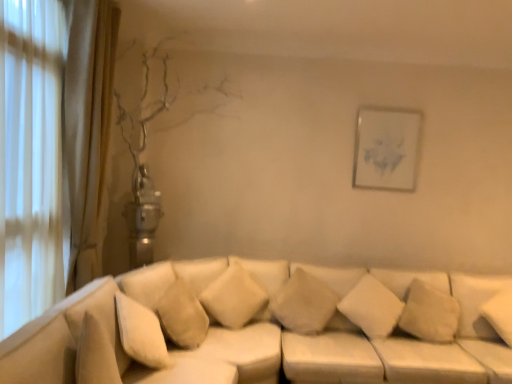
The image size is (512, 384). What are the coordinates of `white soft pillow at right, which is the 1th pillow in right-to-left order` in the screenshot? It's located at (476, 302).

What do you see at coordinates (234, 297) in the screenshot? This screenshot has width=512, height=384. I see `white soft cushion at center, the fourth pillow positioned from the right` at bounding box center [234, 297].

What do you see at coordinates (304, 303) in the screenshot? I see `white soft pillow at center, which is counted as the 3th pillow, starting from the right` at bounding box center [304, 303].

Find the location of `white soft pillow at right, which is the 1th pillow in right-to-left order`. white soft pillow at right, which is the 1th pillow in right-to-left order is located at coordinates (476, 302).

How different are the orientations of white soft cushion at center, the fourth pillow positioned from the right, and white paper at upper right in degrees?

The angle between the facing direction of white soft cushion at center, the fourth pillow positioned from the right, and the facing direction of white paper at upper right is 25.5 degrees.

Looking at this image, from their relative heights in the image, would you say white soft cushion at center, which ranks as the first pillow in left-to-right order, is taller or shorter than white paper at upper right?

Considering their sizes, white soft cushion at center, which ranks as the first pillow in left-to-right order, has less height than white paper at upper right.

Is white soft cushion at center, which ranks as the first pillow in left-to-right order, inside or outside of white paper at upper right?

white soft cushion at center, which ranks as the first pillow in left-to-right order, is located beyond the bounds of white paper at upper right.

Is point (236, 294) less distant than point (413, 131)?

Yes, it is.

Looking at this image, who is bigger, white soft pillow at center, which is counted as the 3th pillow, starting from the right, or white soft pillow at right, which is the 4th pillow from left to right?

With larger size is white soft pillow at center, which is counted as the 3th pillow, starting from the right.

In the scene shown: Does white soft pillow at center, which is counted as the 2th pillow, starting from the left, appear on the left side of white soft pillow at right, which is the 1th pillow in right-to-left order?

Indeed, white soft pillow at center, which is counted as the 2th pillow, starting from the left, is positioned on the left side of white soft pillow at right, which is the 1th pillow in right-to-left order.

Are white soft pillow at center, which is counted as the 3th pillow, starting from the right, and white soft pillow at right, which is the 1th pillow in right-to-left order, located far from each other?

Yes.

From the image's perspective, which is below, white soft pillow at right, which is the 4th pillow from left to right, or white soft pillow at center, positioned as the 3th pillow in left-to-right order?

white soft pillow at right, which is the 4th pillow from left to right, is shown below in the image.

Between white soft pillow at right, which is the 4th pillow from left to right, and white soft pillow at center, which is the 2th pillow in right-to-left order, which one has larger width?

With larger width is white soft pillow at center, which is the 2th pillow in right-to-left order.

Is white soft pillow at right, which is the 1th pillow in right-to-left order, aimed at white soft pillow at center, positioned as the 3th pillow in left-to-right order?

No, white soft pillow at right, which is the 1th pillow in right-to-left order, is not aimed at white soft pillow at center, positioned as the 3th pillow in left-to-right order.

From the image's perspective, which object appears higher, white paper at upper right or white soft cushion at center, which ranks as the first pillow in left-to-right order?

white paper at upper right appears higher in the image.

Is white paper at upper right wider or thinner than white soft cushion at center, which ranks as the first pillow in left-to-right order?

In the image, white paper at upper right appears to be more narrow than white soft cushion at center, which ranks as the first pillow in left-to-right order.

Is the surface of white paper at upper right in direct contact with white soft cushion at center, which ranks as the first pillow in left-to-right order?

No, white paper at upper right is not touching white soft cushion at center, which ranks as the first pillow in left-to-right order.

Who is bigger, white paper at upper right or white soft cushion at center, which ranks as the first pillow in left-to-right order?

With larger size is white soft cushion at center, which ranks as the first pillow in left-to-right order.

Would you say white soft cushion at center, the fourth pillow positioned from the right, is outside white soft pillow at right, which is the 1th pillow in right-to-left order?

That's correct, white soft cushion at center, the fourth pillow positioned from the right, is outside of white soft pillow at right, which is the 1th pillow in right-to-left order.

The height and width of the screenshot is (384, 512). In order to click on pillow that is the 1st one below the white soft cushion at center, the fourth pillow positioned from the right (from a real-world perspective) in this screenshot , I will do `click(476, 302)`.

Considering the positions of objects white soft cushion at center, the fourth pillow positioned from the right, and white soft pillow at right, which is the 1th pillow in right-to-left order, in the image provided, who is behind, white soft cushion at center, the fourth pillow positioned from the right, or white soft pillow at right, which is the 1th pillow in right-to-left order,?

white soft pillow at right, which is the 1th pillow in right-to-left order, is more distant.

From the image's perspective, is white soft cushion at center, the fourth pillow positioned from the right, on white soft pillow at right, which is the 4th pillow from left to right?

Yes, from the image's perspective, white soft cushion at center, the fourth pillow positioned from the right, is above white soft pillow at right, which is the 4th pillow from left to right.

How much distance is there between white soft pillow at center, which is counted as the 2th pillow, starting from the left, and white soft cushion at center, which ranks as the first pillow in left-to-right order?

white soft pillow at center, which is counted as the 2th pillow, starting from the left, and white soft cushion at center, which ranks as the first pillow in left-to-right order, are 11.79 inches apart.

Which object is closer to the camera taking this photo, white soft pillow at center, which is counted as the 2th pillow, starting from the left, or white soft cushion at center, the fourth pillow positioned from the right?

white soft cushion at center, the fourth pillow positioned from the right, is closer to the camera.

Which of these two, white soft pillow at center, which is counted as the 2th pillow, starting from the left, or white soft cushion at center, which ranks as the first pillow in left-to-right order, is smaller?

white soft cushion at center, which ranks as the first pillow in left-to-right order, is smaller.

Identify the location of pillow that is in front of the white soft pillow at center, which is counted as the 2th pillow, starting from the left. This screenshot has height=384, width=512. (234, 297).

From the image's perspective, is white soft pillow at center, which is counted as the 3th pillow, starting from the right, located above or below white soft pillow at center, positioned as the 3th pillow in left-to-right order?

From the image's perspective, white soft pillow at center, which is counted as the 3th pillow, starting from the right, appears above white soft pillow at center, positioned as the 3th pillow in left-to-right order.

From a real-world perspective, is white soft pillow at center, which is counted as the 2th pillow, starting from the left, located beneath white soft pillow at center, which is the 2th pillow in right-to-left order?

Yes, from a real-world perspective, white soft pillow at center, which is counted as the 2th pillow, starting from the left, is below white soft pillow at center, which is the 2th pillow in right-to-left order.

Considering the relative sizes of white soft pillow at center, which is counted as the 3th pillow, starting from the right, and white soft pillow at center, positioned as the 3th pillow in left-to-right order, in the image provided, is white soft pillow at center, which is counted as the 3th pillow, starting from the right, thinner than white soft pillow at center, positioned as the 3th pillow in left-to-right order,?

In fact, white soft pillow at center, which is counted as the 3th pillow, starting from the right, might be wider than white soft pillow at center, positioned as the 3th pillow in left-to-right order.

From the picture: How many degrees apart are the facing directions of white soft pillow at center, which is counted as the 2th pillow, starting from the left, and white soft pillow at center, positioned as the 3th pillow in left-to-right order?

The angular difference between white soft pillow at center, which is counted as the 2th pillow, starting from the left, and white soft pillow at center, positioned as the 3th pillow in left-to-right order, is 8.08 degrees.

I want to click on picture frame that is above the white soft cushion at center, the fourth pillow positioned from the right (from the image's perspective), so click(386, 148).

Locate an element on the screen. pillow that is the 2nd one above the white soft pillow at center, which is counted as the 3th pillow, starting from the right (from a real-world perspective) is located at coordinates (476, 302).

Looking at this image, from the image, which object appears to be nearer to white soft cushion at center, the fourth pillow positioned from the right, white soft pillow at center, which is counted as the 2th pillow, starting from the left, or white soft pillow at center, which is the 2th pillow in right-to-left order?

white soft pillow at center, which is counted as the 2th pillow, starting from the left, is closer to white soft cushion at center, the fourth pillow positioned from the right.

Considering their positions, is white soft pillow at center, positioned as the 3th pillow in left-to-right order, positioned further to white paper at upper right than white soft pillow at right, which is the 1th pillow in right-to-left order?

Based on the image, white soft pillow at right, which is the 1th pillow in right-to-left order, appears to be further to white paper at upper right.

Based on their spatial positions, is white soft cushion at center, the fourth pillow positioned from the right, or white soft pillow at center, positioned as the 3th pillow in left-to-right order, further from white soft pillow at right, which is the 1th pillow in right-to-left order?

white soft cushion at center, the fourth pillow positioned from the right.

Which object lies nearer to the anchor point white soft pillow at center, which is counted as the 3th pillow, starting from the right, white paper at upper right or white soft cushion at center, the fourth pillow positioned from the right?

white soft cushion at center, the fourth pillow positioned from the right, is positioned closer to the anchor white soft pillow at center, which is counted as the 3th pillow, starting from the right.

From the image, which object appears to be nearer to white paper at upper right, white soft cushion at center, the fourth pillow positioned from the right, or white soft pillow at right, which is the 1th pillow in right-to-left order?

white soft pillow at right, which is the 1th pillow in right-to-left order, is closer to white paper at upper right.

Based on their spatial positions, is white soft pillow at right, which is the 4th pillow from left to right, or white soft cushion at center, the fourth pillow positioned from the right, closer to white paper at upper right?

white soft pillow at right, which is the 4th pillow from left to right, is closer to white paper at upper right.

Looking at the image, which one is located further to white soft pillow at right, which is the 4th pillow from left to right, white paper at upper right or white soft pillow at center, positioned as the 3th pillow in left-to-right order?

white paper at upper right lies further to white soft pillow at right, which is the 4th pillow from left to right, than the other object.

Looking at the image, which one is located closer to white paper at upper right, white soft pillow at right, which is the 4th pillow from left to right, or white soft pillow at center, which is counted as the 3th pillow, starting from the right?

white soft pillow at right, which is the 4th pillow from left to right.

Identify the location of pillow located between white soft pillow at center, which is counted as the 2th pillow, starting from the left, and white soft pillow at right, which is the 4th pillow from left to right, in the left-right direction. (372, 307).

The height and width of the screenshot is (384, 512). In order to click on pillow located between white soft cushion at center, which ranks as the first pillow in left-to-right order, and white soft pillow at center, positioned as the 3th pillow in left-to-right order, in the left-right direction in this screenshot , I will do `click(304, 303)`.

Locate an element on the screen. The height and width of the screenshot is (384, 512). picture frame between white soft pillow at center, which is counted as the 2th pillow, starting from the left, and white soft pillow at right, which is the 1th pillow in right-to-left order, from left to right is located at coordinates (386, 148).

Where is `pillow between white paper at upper right and white soft pillow at center, which is counted as the 2th pillow, starting from the left, vertically`? The height and width of the screenshot is (384, 512). pillow between white paper at upper right and white soft pillow at center, which is counted as the 2th pillow, starting from the left, vertically is located at coordinates (234, 297).